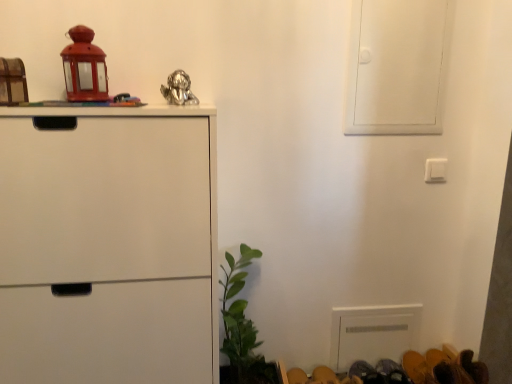
Question: Is point (160, 92) positioned closer to the camera than point (402, 105)?

Choices:
 (A) farther
 (B) closer

Answer: (B)

Question: From the image's perspective, is shiny metallic figurine at upper center, which is the 3th toy from left to right, located above or below white matte screen door at upper right?

Choices:
 (A) above
 (B) below

Answer: (B)

Question: Which object is the farthest from the green leafy plant at lower center?

Choices:
 (A) brown leather shoes at lower right
 (B) white matte cabinet at left
 (C) wooden block at left, the third toy positioned from the right
 (D) shiny metallic figurine at upper center, which is the 3th toy from left to right
 (E) white plastic light switch at upper right

Answer: (C)

Question: Which object is positioned farthest from the matte red lantern at upper left, marked as the second toy in a right-to-left arrangement?

Choices:
 (A) shiny metallic figurine at upper center, which is the 1th toy in right-to-left order
 (B) white matte screen door at upper right
 (C) white plastic light switch at upper right
 (D) wooden block at left, the third toy positioned from the right
 (E) green leafy plant at lower center

Answer: (C)